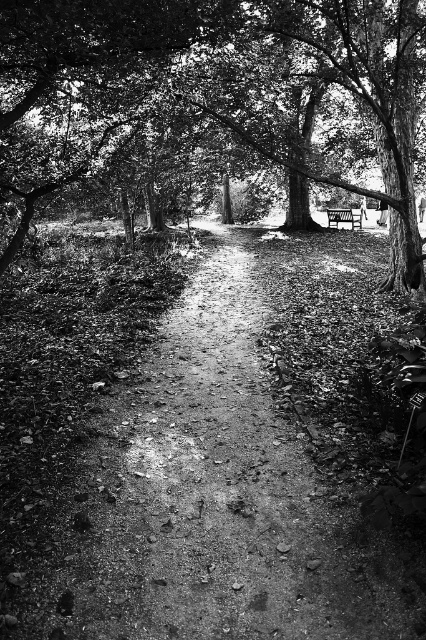
You are a hiker trying to follow the dirt path at center in the woods. There is a smooth bark tree at center blocking your view. Can you see the path clearly? Explain why or why not.

The dirt path at center is below the smooth bark tree at center, so the tree might be casting a shadow or blocking the view of the path, making it less visible.

You are a hiker who wants to take a break on the wooden bench at center. However, you need to ensure that the smooth bark tree at center won not block the sunlight reaching the bench. Based on the scene description, can you determine if the tree is tall enough to cast a shadow over the bench?

The smooth bark tree at center is taller than the wooden bench at center. Since the tree is taller, it can cast a shadow over the bench depending on the time of day and sun angle, but the description does not provide information about the current lighting conditions. Therefore, it is possible the tree could block sunlight, but this depends on external factors not mentioned.